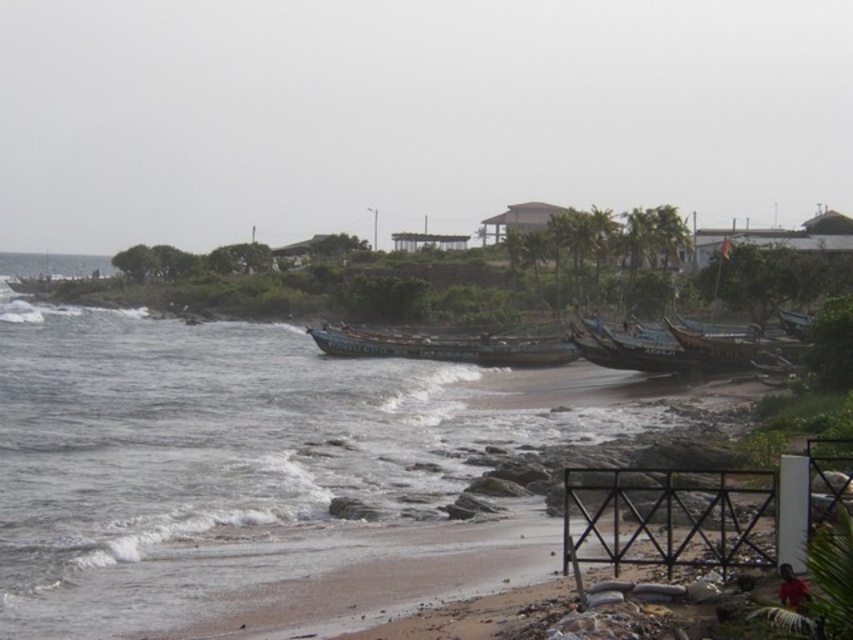
Is point (148, 513) more distant than point (350, 355)?

No, (148, 513) is in front of (350, 355).

Between point (183, 397) and point (520, 342), which one is positioned behind?

Positioned behind is point (520, 342).

Locate an element on the screen. This screenshot has width=853, height=640. blue water at lower left is located at coordinates (245, 461).